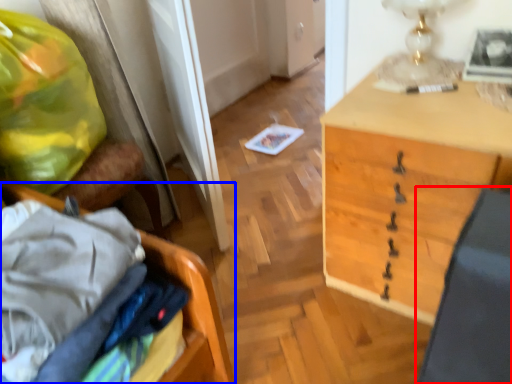
Question: Which object appears closest to the camera in this image, swivel chair (highlighted by a red box) or furniture (highlighted by a blue box)?

Choices:
 (A) swivel chair
 (B) furniture

Answer: (A)